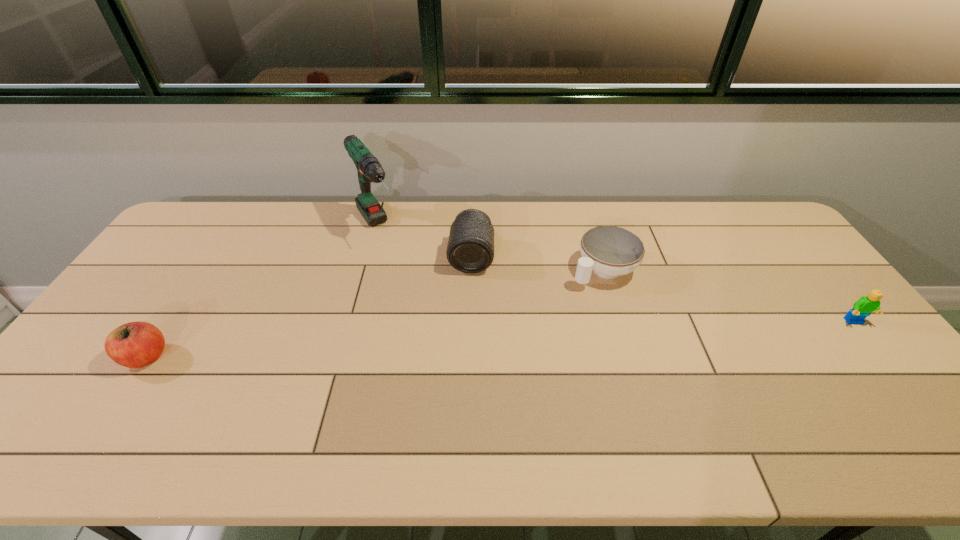
Locate an element on the screen. This screenshot has height=540, width=960. vacant space situated 0.090m on the face of the Lego is located at coordinates (879, 354).

This screenshot has width=960, height=540. I want to click on free space located 0.400m on the side with the handle of the chinaware, so click(x=479, y=352).

Where is `free location located 0.360m on the side with the handle of the chinaware`? The image size is (960, 540). free location located 0.360m on the side with the handle of the chinaware is located at coordinates (491, 344).

Where is `free space located on the side with the handle of the chinaware`? free space located on the side with the handle of the chinaware is located at coordinates (569, 291).

Where is `vacant area situated on the surface of the telephoto lens`? vacant area situated on the surface of the telephoto lens is located at coordinates (461, 386).

Image resolution: width=960 pixels, height=540 pixels. Find the location of `free space located 0.210m on the surface of the telephoto lens`. free space located 0.210m on the surface of the telephoto lens is located at coordinates (466, 329).

Where is `blank space located 0.380m on the surface of the telephoto lens`? This screenshot has height=540, width=960. blank space located 0.380m on the surface of the telephoto lens is located at coordinates (461, 383).

Find the location of a particular element. Image resolution: width=960 pixels, height=540 pixels. vacant point located on the handle side of the second object from left to right is located at coordinates (422, 306).

You are a GUI agent. You are given a task and a screenshot of the screen. Output one action in this format:
    pyautogui.click(x=<x>, y=<y>)
    Task: Click on the free space located on the handle side of the second object from left to right
    This screenshot has height=540, width=960.
    Given the screenshot: What is the action you would take?
    [x=410, y=287]

The width and height of the screenshot is (960, 540). Find the location of `free space located 0.360m on the handle side of the second object from left to right`. free space located 0.360m on the handle side of the second object from left to right is located at coordinates pos(435,325).